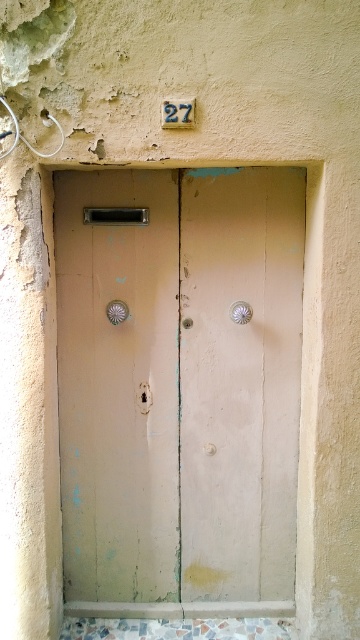
You are trying to open the door and notice two door handles. Which one is closer to you, the matte silver door handle at center or the metallic silver door handle at center?

The matte silver door handle at center is closer to you because it is further to the viewer than the metallic silver door handle at center, meaning it protrudes more towards your position.

Based on the photo, you are a locksmith examining the door and notice two door handles. The door has a matte silver door handle at center and a satin silver door handle at center. Which handle is shorter in height?

The matte silver door handle at center is shorter in height than the satin silver door handle at center.